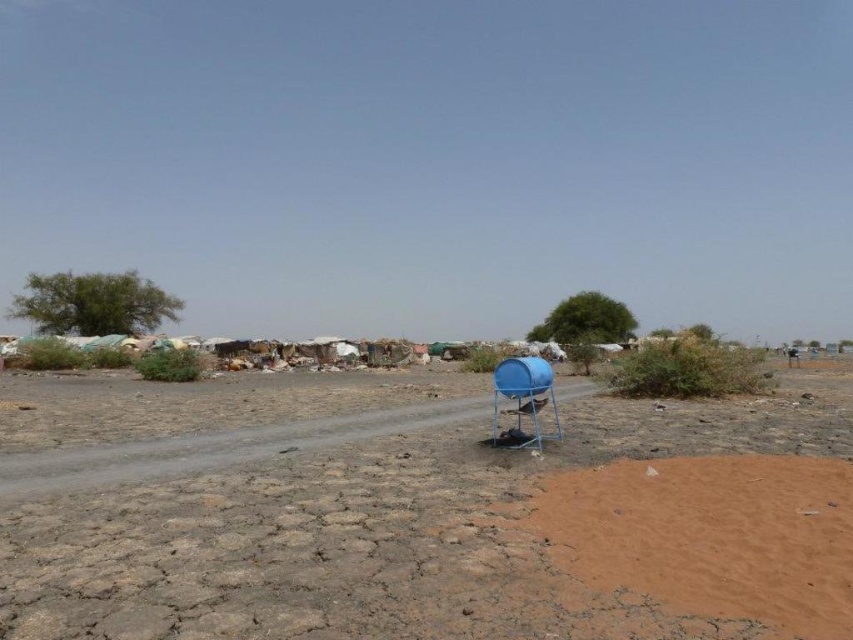
Question: Which object is positioned closest to the brown sandy ground at lower right?

Choices:
 (A) blue plastic barrel at center-right
 (B) dried mud dirt field at center

Answer: (A)

Question: Is dried mud dirt field at center smaller than brown sandy ground at lower right?

Choices:
 (A) no
 (B) yes

Answer: (A)

Question: Is dried mud dirt field at center bigger than brown sandy ground at lower right?

Choices:
 (A) no
 (B) yes

Answer: (B)

Question: Which object is positioned closest to the brown sandy ground at lower right?

Choices:
 (A) blue plastic barrel at center-right
 (B) dried mud dirt field at center

Answer: (A)

Question: Which point is farther to the camera?

Choices:
 (A) (686, 540)
 (B) (531, 360)

Answer: (B)

Question: Can you confirm if dried mud dirt field at center is positioned to the right of blue plastic barrel at center-right?

Choices:
 (A) yes
 (B) no

Answer: (B)